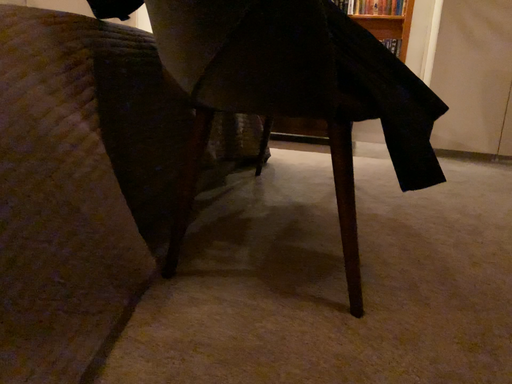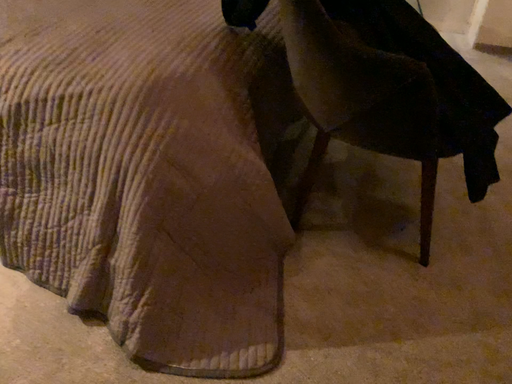
Question: Which way did the camera rotate in the video?

Choices:
 (A) rotated downward
 (B) rotated upward

Answer: (A)